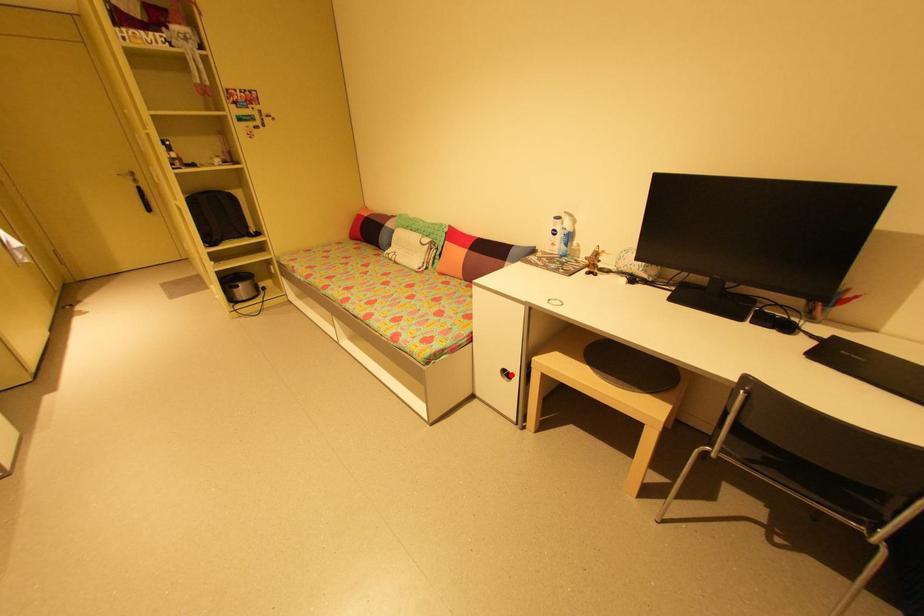
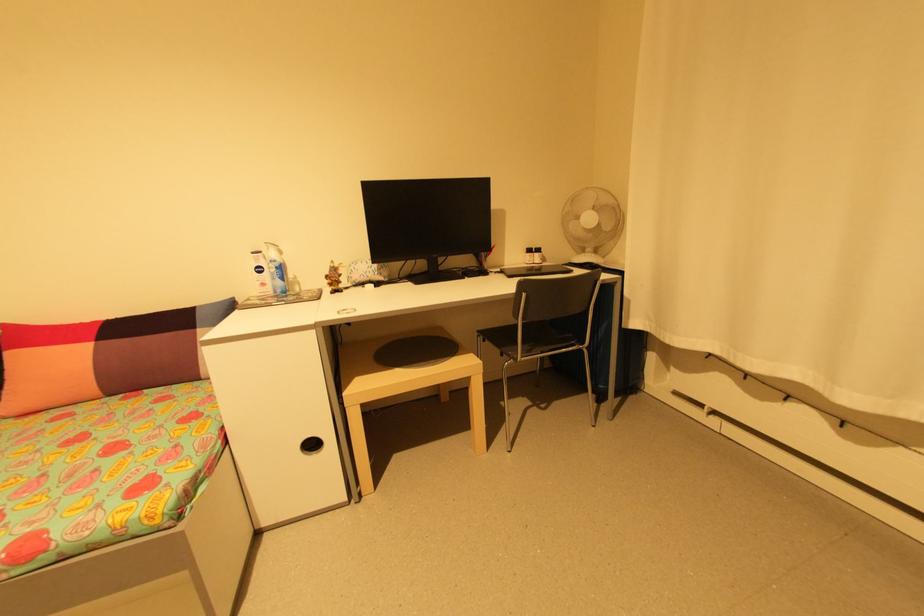
Question: A red point is marked in image1. In image2, is the corresponding 3D point closer to the camera or farther? Reply with the corresponding letter.

Choices:
 (A) The corresponding 3D point is closer.
 (B) The corresponding 3D point is farther.

Answer: (B)